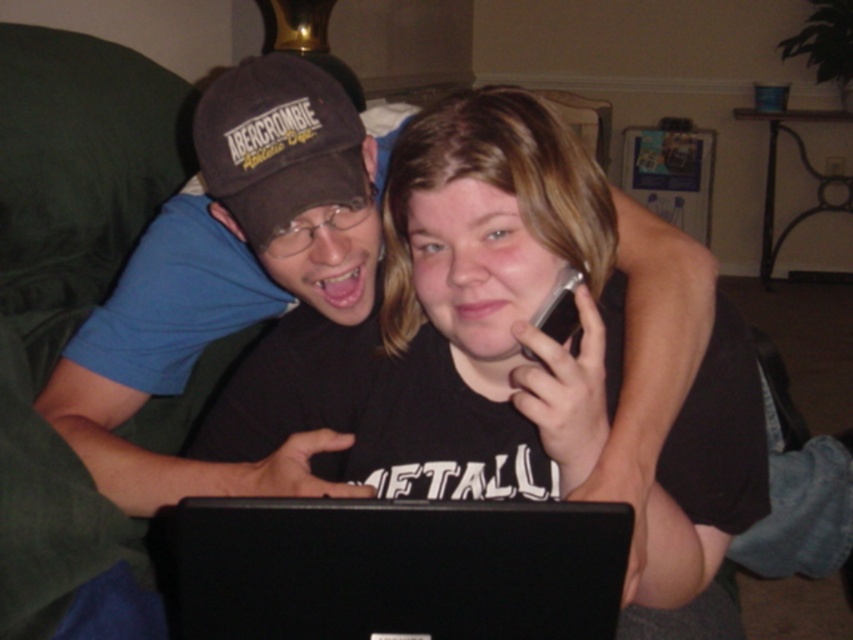
Question: Considering the real-world distances, which object is closest to the black matte laptop at center?

Choices:
 (A) dark brown fabric baseball cap at upper left
 (B) silver metallic phone at upper center

Answer: (B)

Question: Where is black matte laptop at center located in relation to dark brown fabric baseball cap at upper left in the image?

Choices:
 (A) above
 (B) below

Answer: (B)

Question: Which object is positioned farthest from the black matte laptop at center?

Choices:
 (A) silver metallic phone at upper center
 (B) dark brown fabric baseball cap at upper left

Answer: (B)

Question: Can you confirm if black matte laptop at center is bigger than silver metallic phone at upper center?

Choices:
 (A) no
 (B) yes

Answer: (B)

Question: Is the position of black matte laptop at center more distant than that of silver metallic phone at upper center?

Choices:
 (A) no
 (B) yes

Answer: (A)

Question: Which of the following is the closest to the observer?

Choices:
 (A) (201, 612)
 (B) (283, 150)
 (C) (552, 333)

Answer: (A)